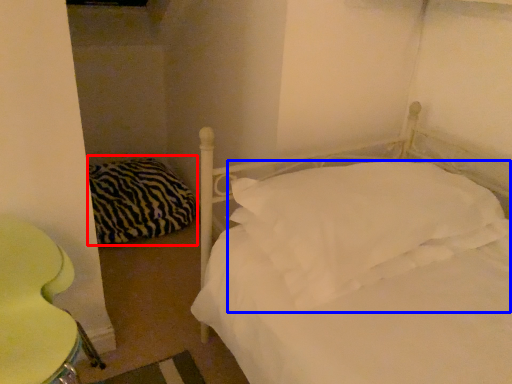
Question: Which object appears closest to the camera in this image, pillow (highlighted by a red box) or pillow (highlighted by a blue box)?

Choices:
 (A) pillow
 (B) pillow

Answer: (B)